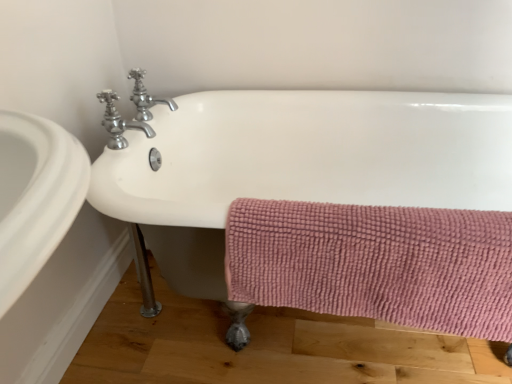
Question: Should I look upward or downward to see pink textured towel at lower right?

Choices:
 (A) up
 (B) down

Answer: (B)

Question: Does pink textured towel at lower right have a greater height compared to white ceramic bathtub at center?

Choices:
 (A) yes
 (B) no

Answer: (B)

Question: Is pink textured towel at lower right at the right side of white ceramic bathtub at center?

Choices:
 (A) yes
 (B) no

Answer: (B)

Question: Is pink textured towel at lower right next to white ceramic bathtub at center and touching it?

Choices:
 (A) no
 (B) yes

Answer: (A)

Question: Considering the relative sizes of pink textured towel at lower right and white ceramic bathtub at center in the image provided, is pink textured towel at lower right wider than white ceramic bathtub at center?

Choices:
 (A) yes
 (B) no

Answer: (B)

Question: From the image's perspective, would you say pink textured towel at lower right is positioned over white ceramic bathtub at center?

Choices:
 (A) no
 (B) yes

Answer: (A)

Question: Is pink textured towel at lower right far from white ceramic bathtub at center?

Choices:
 (A) yes
 (B) no

Answer: (B)

Question: Is polished chrome faucet at upper left, which is the 2th tap in front-to-back order, closer to camera compared to white ceramic bathtub at center?

Choices:
 (A) yes
 (B) no

Answer: (B)

Question: Is white ceramic bathtub at center surrounded by polished chrome faucet at upper left, which is the 2th tap in front-to-back order?

Choices:
 (A) yes
 (B) no

Answer: (B)

Question: From a real-world perspective, is polished chrome faucet at upper left, which is the 2th tap in front-to-back order, physically below white ceramic bathtub at center?

Choices:
 (A) yes
 (B) no

Answer: (B)

Question: Is polished chrome faucet at upper left, which is the 2th tap in front-to-back order, looking in the opposite direction of white ceramic bathtub at center?

Choices:
 (A) yes
 (B) no

Answer: (B)

Question: Does polished chrome faucet at upper left, positioned as the 1th tap in back-to-front order, appear on the left side of white ceramic bathtub at center?

Choices:
 (A) no
 (B) yes

Answer: (B)

Question: Can you confirm if polished chrome faucet at upper left, which is the 2th tap in front-to-back order, is bigger than white ceramic bathtub at center?

Choices:
 (A) yes
 (B) no

Answer: (B)

Question: Is white ceramic bathtub at center next to polished chrome faucet at upper left, positioned as the 1th tap in back-to-front order?

Choices:
 (A) no
 (B) yes

Answer: (A)